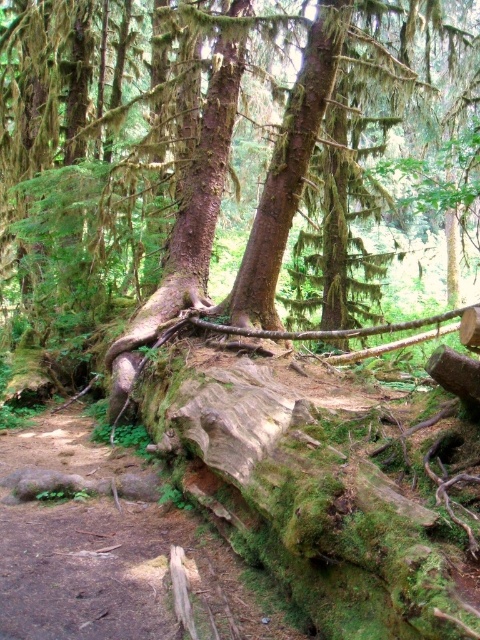
You are a hiker who wants to cross the forest floor to reach the tall trees in the background. There is a green mossy log at lower center and a green mossy tree trunk at center in your path. Can you walk between them without needing to climb over or go around?

The distance between the green mossy log at lower center and the green mossy tree trunk at center is 11.49 feet, which is a sufficient gap for a hiker to walk through comfortably without needing to climb over or go around.

You are a hiker trying to cross the forest floor. You see the green mossy log at lower center and the green mossy tree trunk at center. Which object is wider?

The green mossy log at lower center is wider than the green mossy tree trunk at center according to the description.

From the picture: You are a hiker who wants to cross the forest floor. You see the green mossy log at lower center and the green mossy tree trunk at center. Which object is closer to you?

The green mossy log at lower center is above the green mossy tree trunk at center, so it is closer to you.